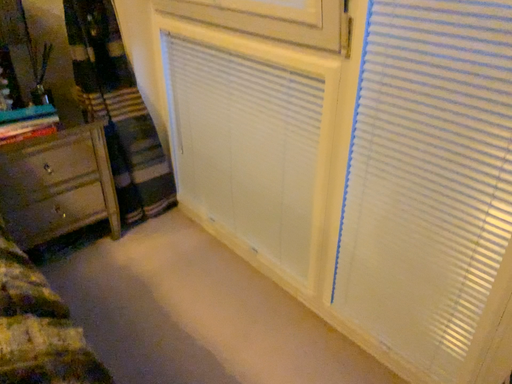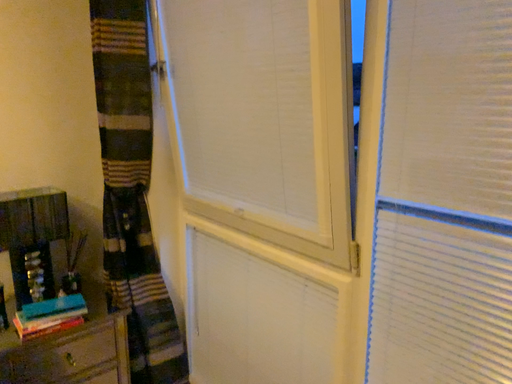
Question: Which way did the camera rotate in the video?

Choices:
 (A) rotated upward
 (B) rotated downward

Answer: (A)